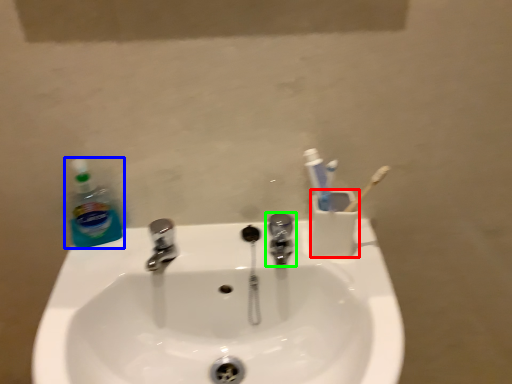
Question: Which is nearer to the liquid (highlighted by a red box)? cleaning product (highlighted by a blue box) or tap (highlighted by a green box).

Choices:
 (A) cleaning product
 (B) tap

Answer: (B)